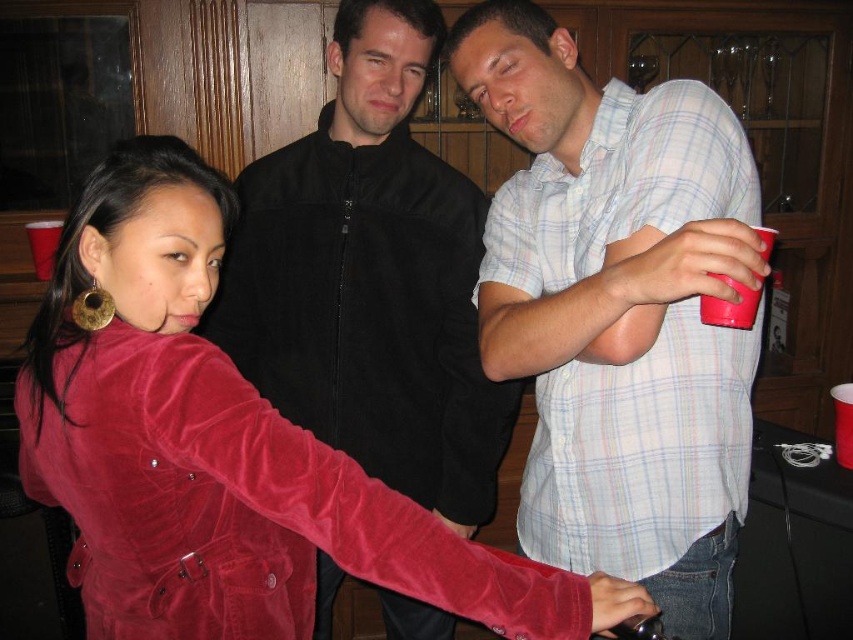
Based on the photo, you are a bartender who needs to place a coaster between the velvet jacket at center and the matte plastic cup at right. The coaster has a diameter of 4 inches. Can you fit the coaster between them without moving either object?

The velvet jacket at center and the matte plastic cup at right are 29.87 inches apart. Subtracting the coaster diameter of 4 inches, there is still 25.87 inches of space remaining. Therefore, yes, the coaster can easily be placed between them without moving either object.

You are standing in the bar and see the velvet red jacket at center. If your arm is 30 inches long, can you reach it without moving?

The velvet red jacket at center is 31.69 inches from viewer. Since your arm is 30 inches long, you cannot reach it without moving closer.

You are at a bar and want to place your matte plastic cup at right on the counter next to the velvet red jacket at center. Is the cup to the left or right of the jacket?

The matte plastic cup at right is to the right of the velvet red jacket at center because the velvet red jacket at center is positioned on the left side of the matte plastic cup at right.